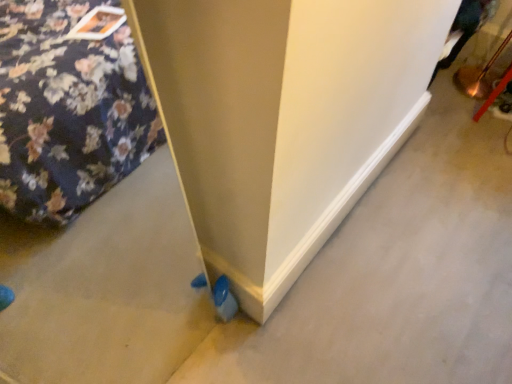
In order to face blue rubber toy at lower center, should I rotate leftwards or rightwards?

Turn left by 4.447 degrees to look at blue rubber toy at lower center.

Describe the element at coordinates (224, 299) in the screenshot. I see `blue rubber toy at lower center` at that location.

At what (x,y) coordinates should I click in order to perform the action: click on blue rubber toy at lower center. Please return your answer as a coordinate pair (x, y). The height and width of the screenshot is (384, 512). Looking at the image, I should click on [224, 299].

This screenshot has width=512, height=384. I want to click on blue rubber toy at lower center, so click(x=224, y=299).